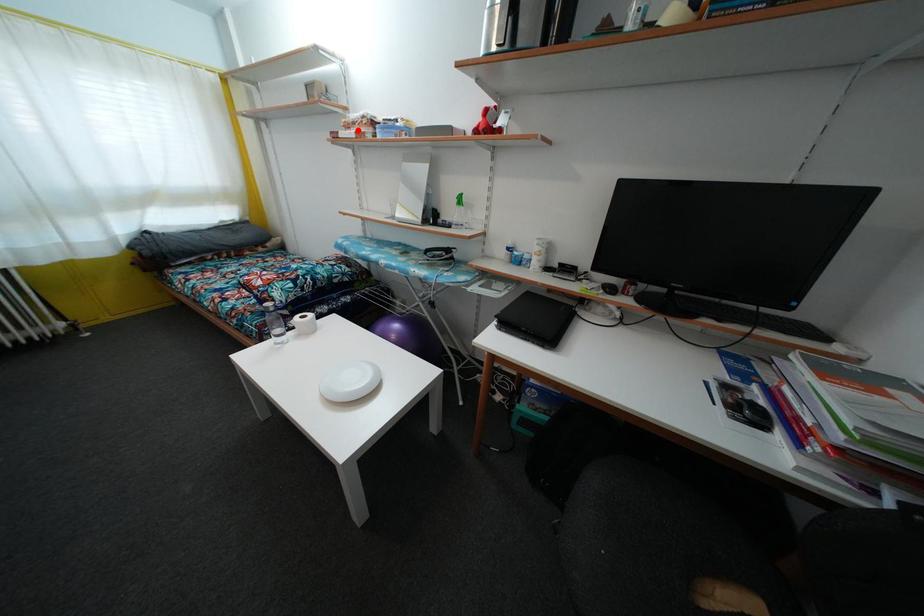
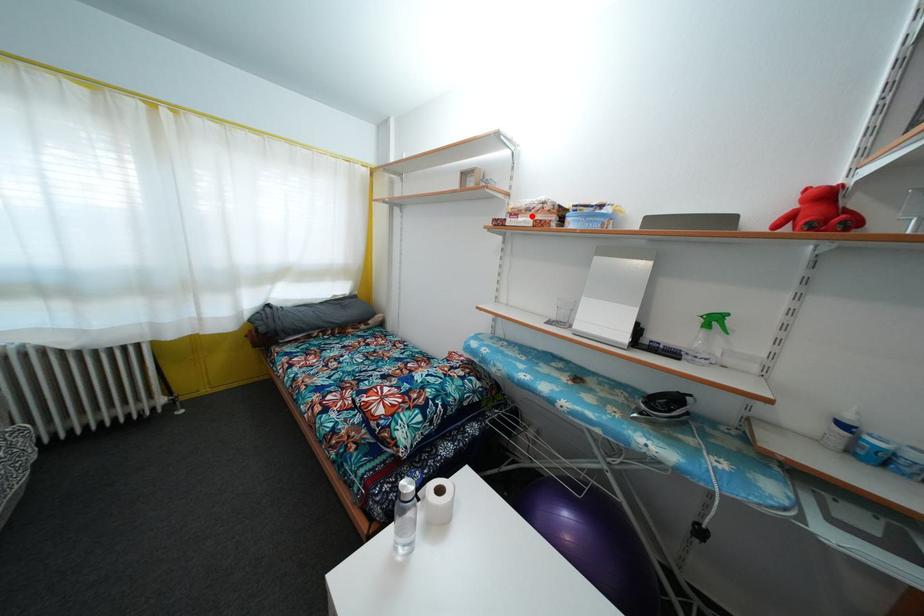
I am providing you with two images of the same scene from different viewpoints. A red point is marked on the first image and another point is marked on the second image. Is the marked point in image1 the same physical position as the marked point in image2?

Yes